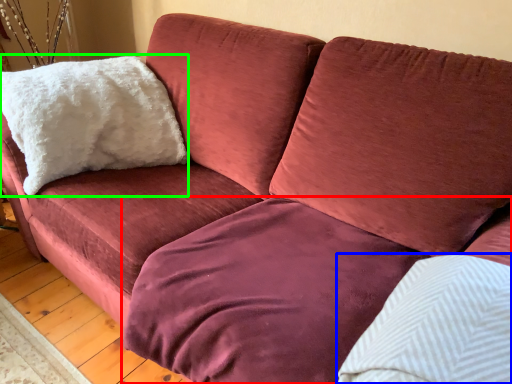
Question: Estimate the real-world distances between objects in this image. Which object is closer to bedding (highlighted by a red box), pillow (highlighted by a blue box) or pillow (highlighted by a green box)?

Choices:
 (A) pillow
 (B) pillow

Answer: (A)